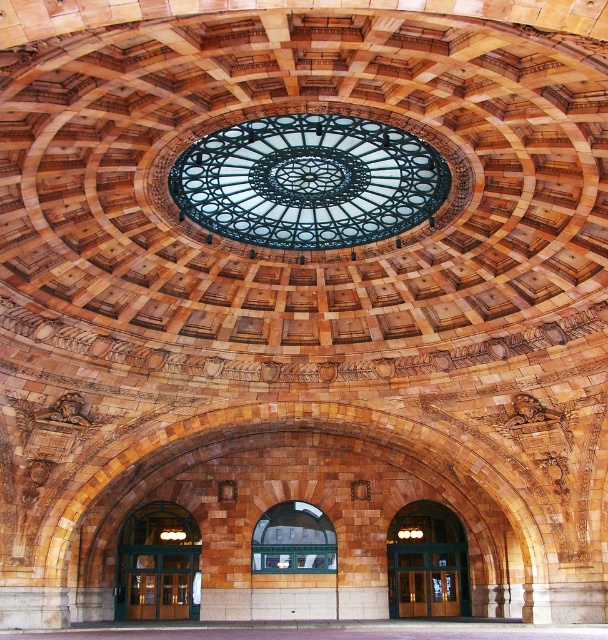
You are an architect evaluating the symmetry of the building. Which object, the green glass doors at center or the clear glass window at center, is taller?

The green glass doors at center are taller than the clear glass window at center.